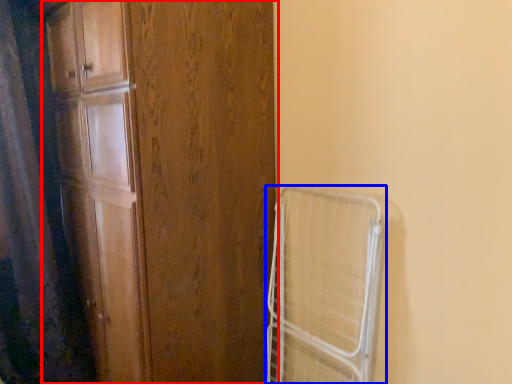
Question: Among these objects, which one is nearest to the camera, door (highlighted by a red box) or cage (highlighted by a blue box)?

Choices:
 (A) door
 (B) cage

Answer: (A)